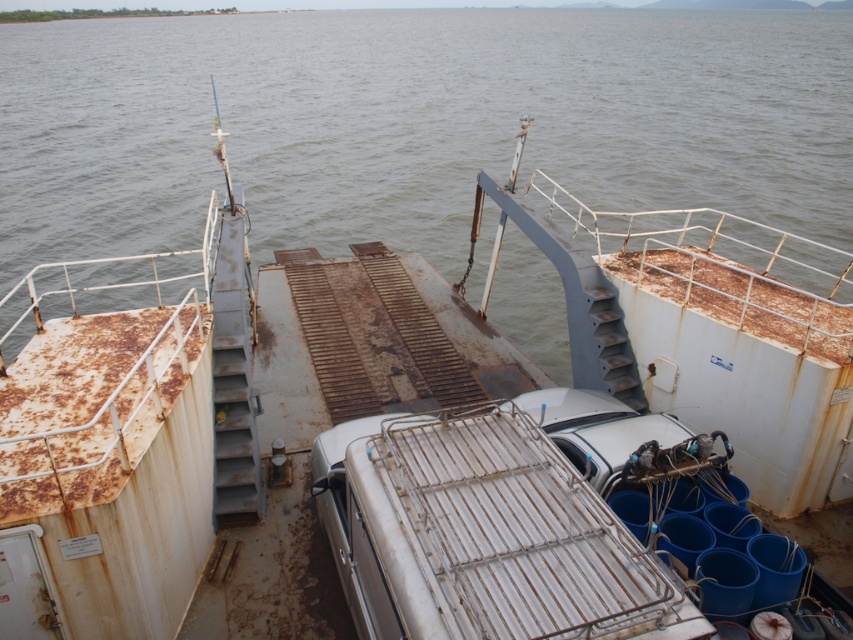
How distant is rusty water at center from white matte boat at center?

27.82 meters

The width and height of the screenshot is (853, 640). Identify the location of rusty water at center. (413, 124).

Between point (576, 10) and point (762, 420), which one is positioned in front?

Point (762, 420) is more forward.

The width and height of the screenshot is (853, 640). Find the location of `rusty water at center`. rusty water at center is located at coordinates (413, 124).